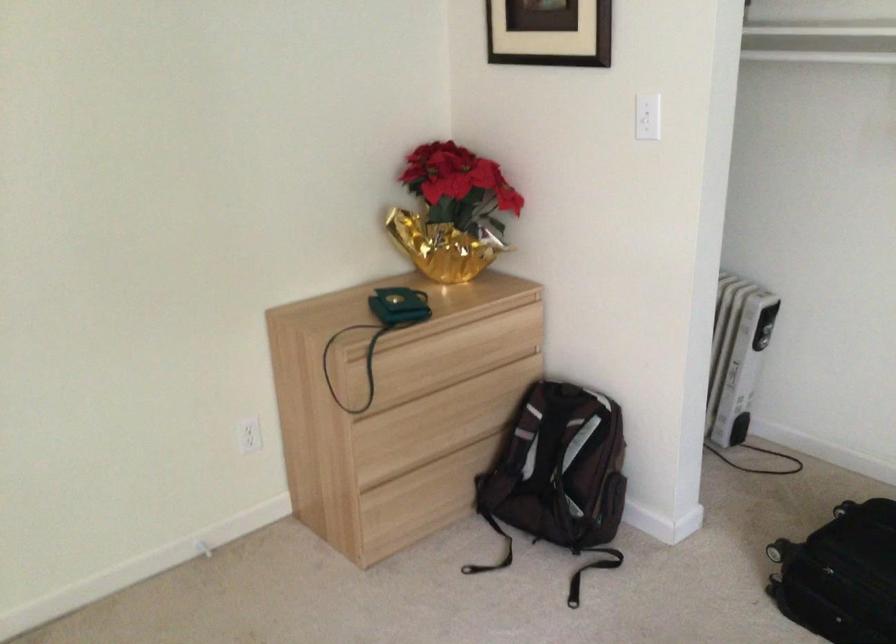
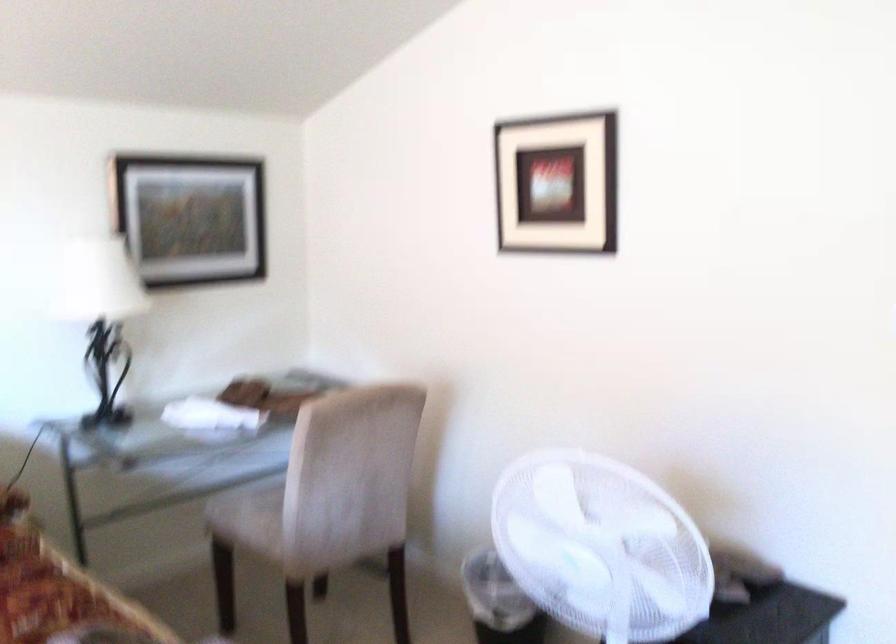
Question: The camera is either moving clockwise (left) or counter-clockwise (right) around the object. The first image is from the beginning of the video and the second image is from the end. Is the camera moving left or right when shooting the video?

Choices:
 (A) Left
 (B) Right

Answer: (B)